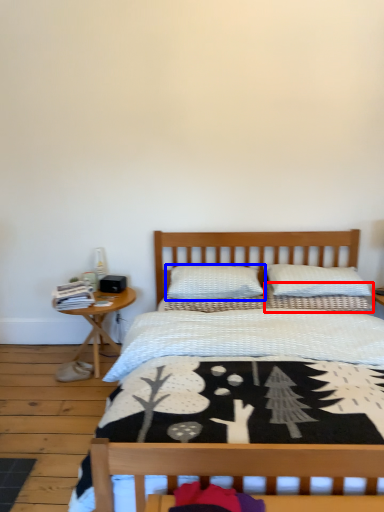
Question: Which point is further to the camera, pillow (highlighted by a red box) or pillow (highlighted by a blue box)?

Choices:
 (A) pillow
 (B) pillow

Answer: (A)